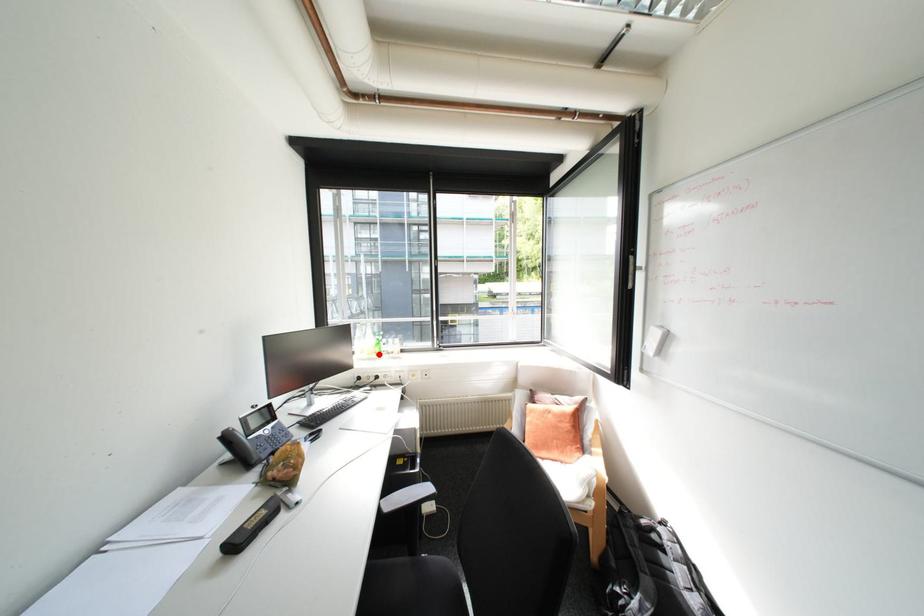
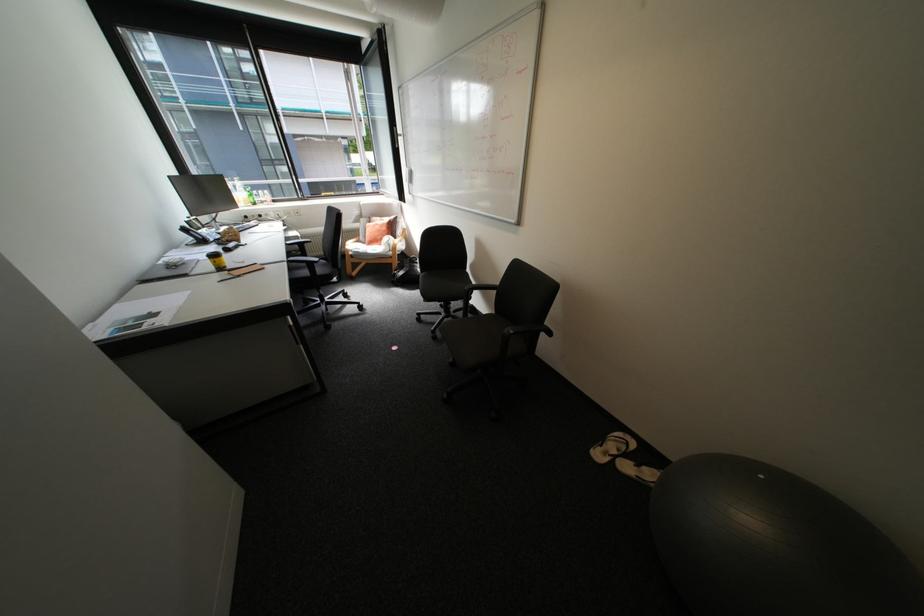
Question: I am providing you with two images of the same scene from different viewpoints. Image1 has a red point marked. In image2, the corresponding 3D location appears at what relative position? Reply with the corresponding letter.

Choices:
 (A) Closer
 (B) Farther

Answer: (A)